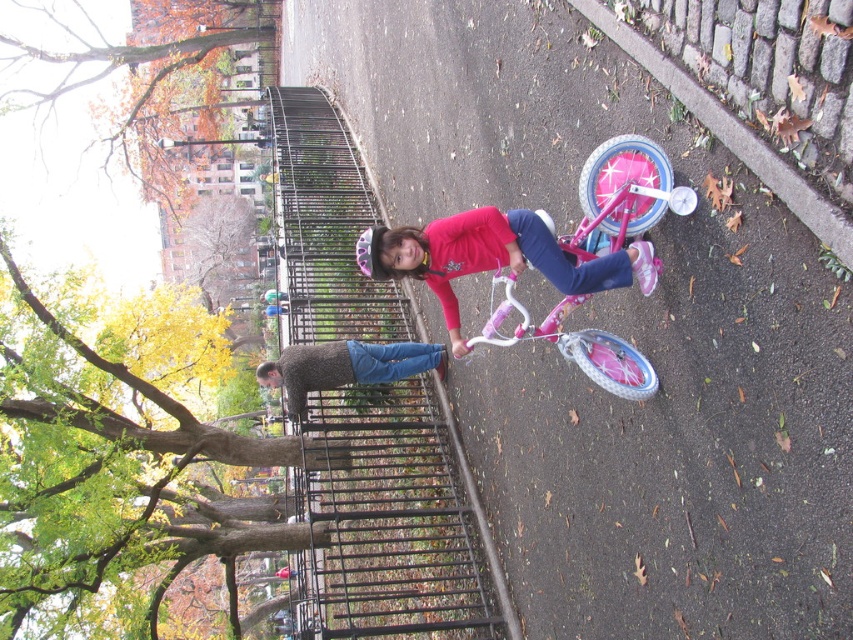
Between point (527, 337) and point (410, 250), which one is positioned in front?

Positioned in front is point (410, 250).

Identify the location of pink metallic bicycle at center. The width and height of the screenshot is (853, 640). (624, 204).

Which is behind, point (676, 196) or point (428, 358)?

Point (428, 358)

Locate an element on the screen. pink metallic bicycle at center is located at coordinates (624, 204).

Who is shorter, pink glossy bicycle at center or knitted sweater at center?

knitted sweater at center

Which is in front, point (543, 234) or point (340, 342)?

Point (543, 234)

Who is more forward, (447, 259) or (403, 362)?

Positioned in front is point (447, 259).

Locate an element on the screen. The image size is (853, 640). pink glossy bicycle at center is located at coordinates (492, 257).